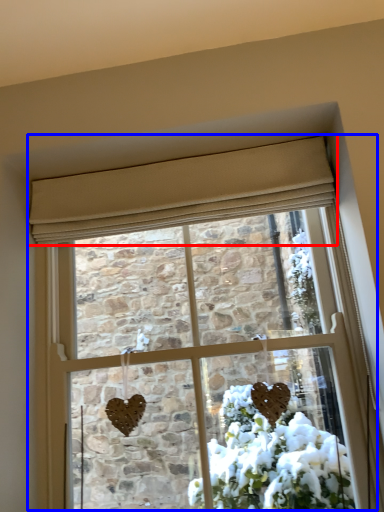
Question: Which object appears farthest to the camera in this image, curtain (highlighted by a red box) or window (highlighted by a blue box)?

Choices:
 (A) curtain
 (B) window

Answer: (A)